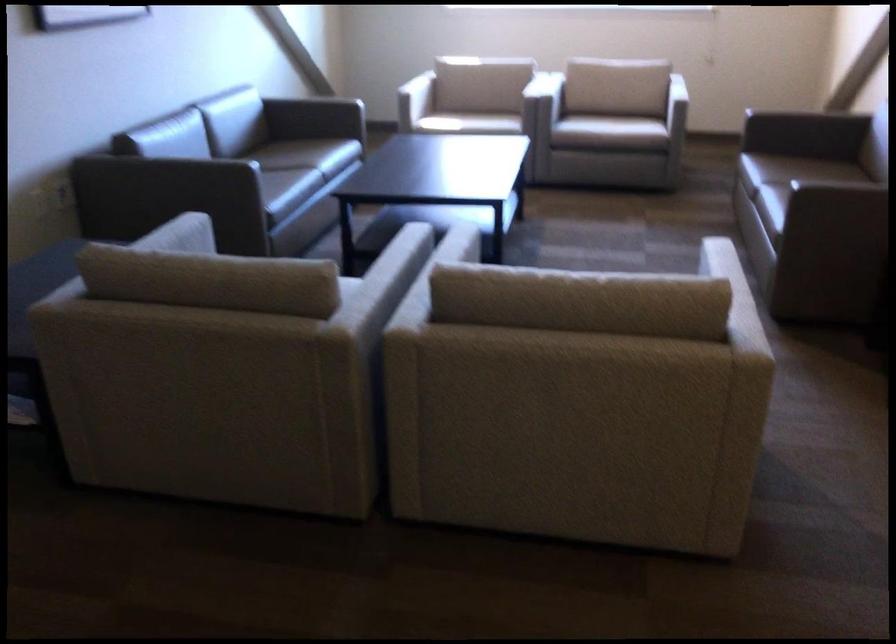
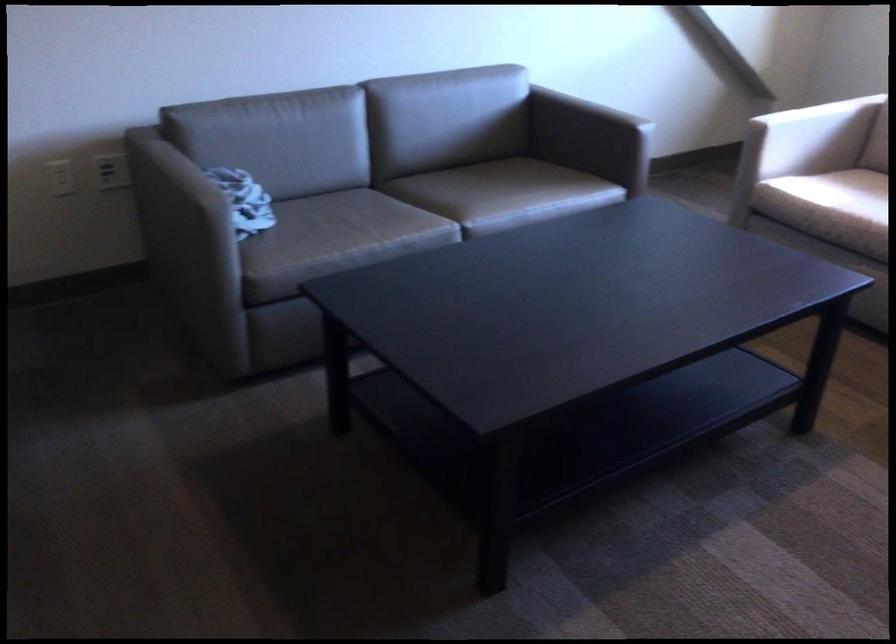
The point at (412,84) is marked in the first image. Where is the corresponding point in the second image?

(824, 137)